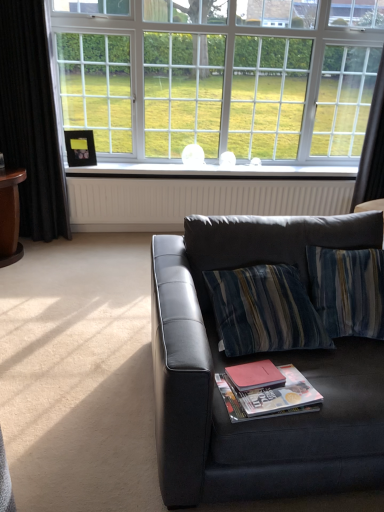
Describe the element at coordinates (31, 120) in the screenshot. I see `black velvet curtain at left, acting as the second curtain starting from the right` at that location.

Describe the element at coordinates (270, 397) in the screenshot. I see `matte paper magazine at lower center` at that location.

Find the location of `matte paper magazine at lower center`. matte paper magazine at lower center is located at coordinates (270, 397).

Find the location of a particular element. The image size is (384, 512). white glossy window sill at center is located at coordinates (212, 170).

This screenshot has width=384, height=512. In order to click on white textured radiator at center in this screenshot , I will do `click(195, 200)`.

In the scene shown: Is the depth of white textured radiator at center greater than that of black velvet curtain at left, acting as the second curtain starting from the right?

Yes, it is behind black velvet curtain at left, acting as the second curtain starting from the right.

Which of these two, white textured radiator at center or black velvet curtain at left, the first curtain in the left-to-right sequence, stands shorter?

white textured radiator at center is shorter.

Could you measure the distance between white textured radiator at center and black velvet curtain at left, acting as the second curtain starting from the right?

white textured radiator at center is 33.07 inches from black velvet curtain at left, acting as the second curtain starting from the right.

From a real-world perspective, who is located lower, white textured radiator at center or black velvet curtain at left, the first curtain in the left-to-right sequence?

From a 3D spatial view, white textured radiator at center is below.

How different are the orientations of white glass window at upper center and matte paper magazine at lower center in degrees?

The angular difference between white glass window at upper center and matte paper magazine at lower center is 10.6 degrees.

Between point (76, 46) and point (265, 395), which one is positioned in front?

The point (265, 395) is more forward.

Which object is thinner, white glass window at upper center or matte paper magazine at lower center?

Thinner between the two is matte paper magazine at lower center.

In the scene shown: Considering the relative positions of white glossy window sill at center and matte paper magazine at lower center in the image provided, is white glossy window sill at center to the right of matte paper magazine at lower center from the viewer's perspective?

Indeed, white glossy window sill at center is positioned on the right side of matte paper magazine at lower center.

Which is less distant, (220, 166) or (294, 368)?

The point (294, 368) is more forward.

From the image's perspective, does white glossy window sill at center appear lower than matte paper magazine at lower center?

Actually, white glossy window sill at center appears above matte paper magazine at lower center in the image.

At what (x,y) coordinates should I click in order to perform the action: click on window sill that is above the matte paper magazine at lower center (from a real-world perspective). Please return your answer as a coordinate pair (x, y). The height and width of the screenshot is (512, 384). Looking at the image, I should click on coord(212,170).

From the image's perspective, which one is positioned higher, white textured radiator at center or matte paper magazine at lower center?

white textured radiator at center is shown above in the image.

From the picture: Can matte paper magazine at lower center be found inside white textured radiator at center?

No, matte paper magazine at lower center is not surrounded by white textured radiator at center.

Can you confirm if white textured radiator at center is shorter than matte paper magazine at lower center?

Incorrect, the height of white textured radiator at center does not fall short of that of matte paper magazine at lower center.

Identify the location of magazine that is above the white textured radiator at center (from a real-world perspective). (270, 397).

Considering their positions, is black velvet curtain at left, the first curtain in the left-to-right sequence, located in front of or behind dark grey fabric curtain at right, the first curtain in the right-to-left sequence?

black velvet curtain at left, the first curtain in the left-to-right sequence, is in front of dark grey fabric curtain at right, the first curtain in the right-to-left sequence.

Is black velvet curtain at left, the first curtain in the left-to-right sequence, aimed at dark grey fabric curtain at right, the first curtain in the right-to-left sequence?

No.

Who is smaller, black velvet curtain at left, the first curtain in the left-to-right sequence, or dark grey fabric curtain at right, the first curtain in the right-to-left sequence?

Smaller between the two is dark grey fabric curtain at right, the first curtain in the right-to-left sequence.

Is white glass window at upper center inside the boundaries of black velvet curtain at left, the first curtain in the left-to-right sequence, or outside?

white glass window at upper center is outside black velvet curtain at left, the first curtain in the left-to-right sequence.

Which object is closer to the camera, white glass window at upper center or black velvet curtain at left, acting as the second curtain starting from the right?

black velvet curtain at left, acting as the second curtain starting from the right, is more forward.

In the scene shown: Between white glass window at upper center and black velvet curtain at left, acting as the second curtain starting from the right, which one has more height?

With more height is black velvet curtain at left, acting as the second curtain starting from the right.

Is dark grey fabric curtain at right, which is the 2th curtain in left-to-right order, inside or outside of black velvet curtain at left, the first curtain in the left-to-right sequence?

dark grey fabric curtain at right, which is the 2th curtain in left-to-right order, is spatially situated outside black velvet curtain at left, the first curtain in the left-to-right sequence.

Considering the relative sizes of dark grey fabric curtain at right, the first curtain in the right-to-left sequence, and black velvet curtain at left, acting as the second curtain starting from the right, in the image provided, is dark grey fabric curtain at right, the first curtain in the right-to-left sequence, smaller than black velvet curtain at left, acting as the second curtain starting from the right,?

Yes, dark grey fabric curtain at right, the first curtain in the right-to-left sequence, is smaller than black velvet curtain at left, acting as the second curtain starting from the right.

From a real-world perspective, who is located higher, dark grey fabric curtain at right, which is the 2th curtain in left-to-right order, or black velvet curtain at left, the first curtain in the left-to-right sequence?

dark grey fabric curtain at right, which is the 2th curtain in left-to-right order, from a real-world perspective.

Looking at this image, does dark grey fabric curtain at right, which is the 2th curtain in left-to-right order, have a greater height compared to black velvet curtain at left, the first curtain in the left-to-right sequence?

No.

Image resolution: width=384 pixels, height=512 pixels. There is a white textured radiator at center. Find the location of `the 1st curtain above it (from a real-world perspective)`. the 1st curtain above it (from a real-world perspective) is located at coordinates (31, 120).

Where is `window lying behind the matte paper magazine at lower center`? window lying behind the matte paper magazine at lower center is located at coordinates (220, 76).

From the image, which object appears to be farther from matte paper magazine at lower center, black velvet curtain at left, the first curtain in the left-to-right sequence, or white glossy window sill at center?

black velvet curtain at left, the first curtain in the left-to-right sequence, is further to matte paper magazine at lower center.

Based on the photo, based on their spatial positions, is black matte picture frame at upper left or matte red paperback book at center further from matte paper magazine at lower center?

black matte picture frame at upper left is positioned further to the anchor matte paper magazine at lower center.

Based on their spatial positions, is black matte picture frame at upper left or dark grey fabric curtain at right, which is the 2th curtain in left-to-right order, closer to matte black couch at center?

The object closer to matte black couch at center is dark grey fabric curtain at right, which is the 2th curtain in left-to-right order.

Considering their positions, is black matte picture frame at upper left positioned closer to white textured radiator at center than matte paper magazine at lower center?

black matte picture frame at upper left lies closer to white textured radiator at center than the other object.

From the image, which object appears to be nearer to white glass window at upper center, matte paper magazine at lower center or white textured radiator at center?

Based on the image, white textured radiator at center appears to be nearer to white glass window at upper center.

Based on their spatial positions, is matte black couch at center or matte red paperback book at center further from white textured radiator at center?

The object further to white textured radiator at center is matte red paperback book at center.

When comparing their distances from matte paper magazine at lower center, does matte black couch at center or dark grey fabric curtain at right, which is the 2th curtain in left-to-right order, seem further?

Based on the image, dark grey fabric curtain at right, which is the 2th curtain in left-to-right order, appears to be further to matte paper magazine at lower center.

Estimate the real-world distances between objects in this image. Which object is closer to matte red paperback book at center, black velvet curtain at left, acting as the second curtain starting from the right, or black matte picture frame at upper left?

black velvet curtain at left, acting as the second curtain starting from the right, is positioned closer to the anchor matte red paperback book at center.

You are a GUI agent. You are given a task and a screenshot of the screen. Output one action in this format:
    pyautogui.click(x=<x>, y=<y>)
    Task: Click on the window located between white glossy window sill at center and dark grey fabric curtain at right, which is the 2th curtain in left-to-right order, in the left-right direction
    The height and width of the screenshot is (512, 384).
    Given the screenshot: What is the action you would take?
    pyautogui.click(x=220, y=76)

In order to click on picture frame located between black velvet curtain at left, acting as the second curtain starting from the right, and white glossy window sill at center in the left-right direction in this screenshot , I will do `click(80, 148)`.

The image size is (384, 512). In order to click on window sill between white glass window at upper center and white textured radiator at center vertically in this screenshot , I will do `click(212, 170)`.

Where is `radiator located between black velvet curtain at left, the first curtain in the left-to-right sequence, and white glass window at upper center in the left-right direction`? Image resolution: width=384 pixels, height=512 pixels. radiator located between black velvet curtain at left, the first curtain in the left-to-right sequence, and white glass window at upper center in the left-right direction is located at coordinates (195, 200).